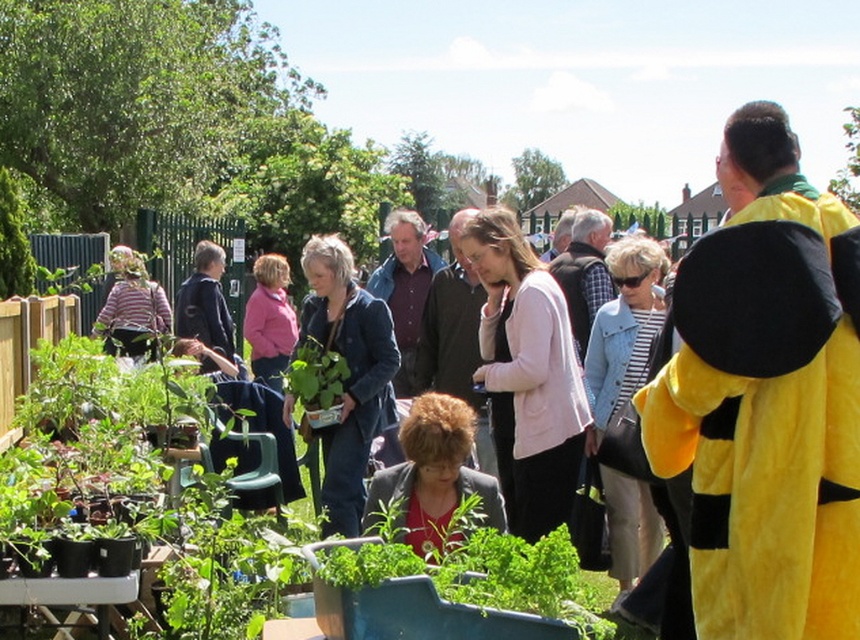
Question: Can you confirm if matte blue jacket at center is smaller than pink fabric jacket at center?

Choices:
 (A) no
 (B) yes

Answer: (A)

Question: Which object is positioned farthest from the yellow plush bee at right?

Choices:
 (A) pink fabric jacket at center
 (B) dark blue jacket at center
 (C) matte blue jacket at center

Answer: (A)

Question: Which is farther from the matte black jacket at center?

Choices:
 (A) pink fabric at center
 (B) striped cotton shirt at center
 (C) matte blue jacket at center
 (D) yellow plush bee at right

Answer: (B)

Question: Which object appears closest to the camera in this image?

Choices:
 (A) light blue denim jacket at center
 (B) dark blue jacket at center
 (C) matte black jacket at center

Answer: (C)

Question: Is green leafy plant at center to the left of dark blue jacket at center from the viewer's perspective?

Choices:
 (A) yes
 (B) no

Answer: (B)

Question: Can you confirm if pink fabric at center is positioned to the left of green leafy plant at center?

Choices:
 (A) yes
 (B) no

Answer: (B)